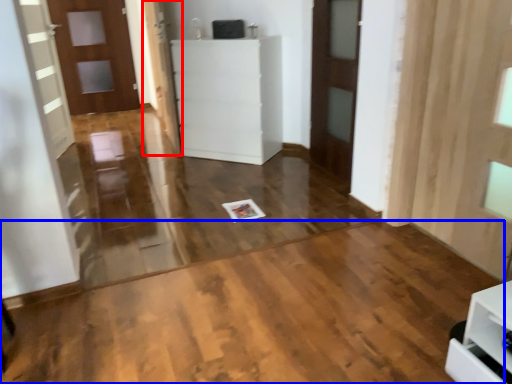
Question: Among these objects, which one is nearest to the camera, door (highlighted by a red box) or plywood (highlighted by a blue box)?

Choices:
 (A) door
 (B) plywood

Answer: (B)